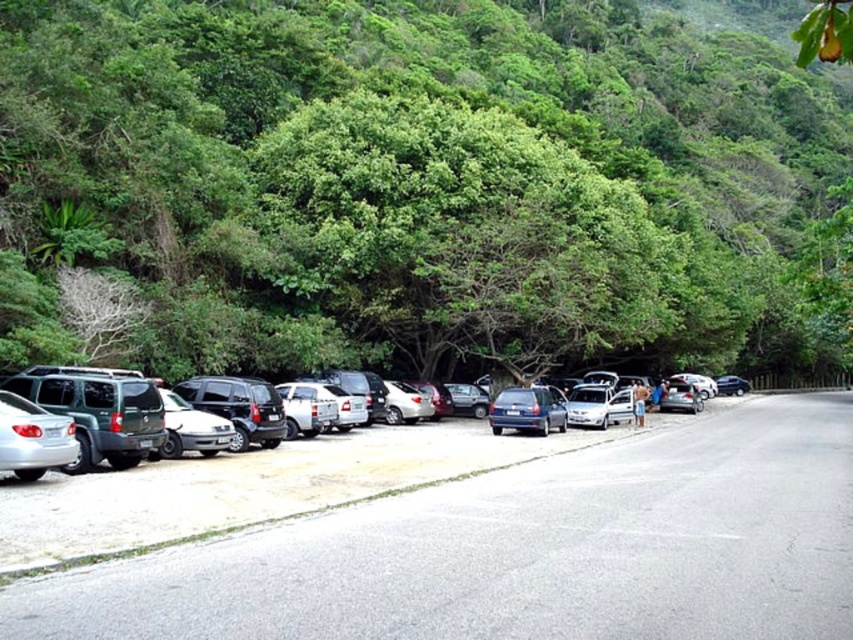
Who is shorter, metallic silver car at center or blue metallic hatchback at center?

metallic silver car at center

Is metallic silver car at center closer to camera compared to blue metallic hatchback at center?

Yes.

The image size is (853, 640). What do you see at coordinates (521, 552) in the screenshot? I see `metallic silver car at center` at bounding box center [521, 552].

Where is `metallic silver car at center`? metallic silver car at center is located at coordinates (521, 552).

Which is more to the left, green leafy tree at center or blue metallic hatchback at center?

From the viewer's perspective, blue metallic hatchback at center appears more on the left side.

The width and height of the screenshot is (853, 640). I want to click on green leafy tree at center, so click(x=418, y=186).

Looking at this image, can you confirm if green leafy tree at center is positioned to the left of metallic silver car at center?

In fact, green leafy tree at center is to the right of metallic silver car at center.

The height and width of the screenshot is (640, 853). Identify the location of green leafy tree at center. (418, 186).